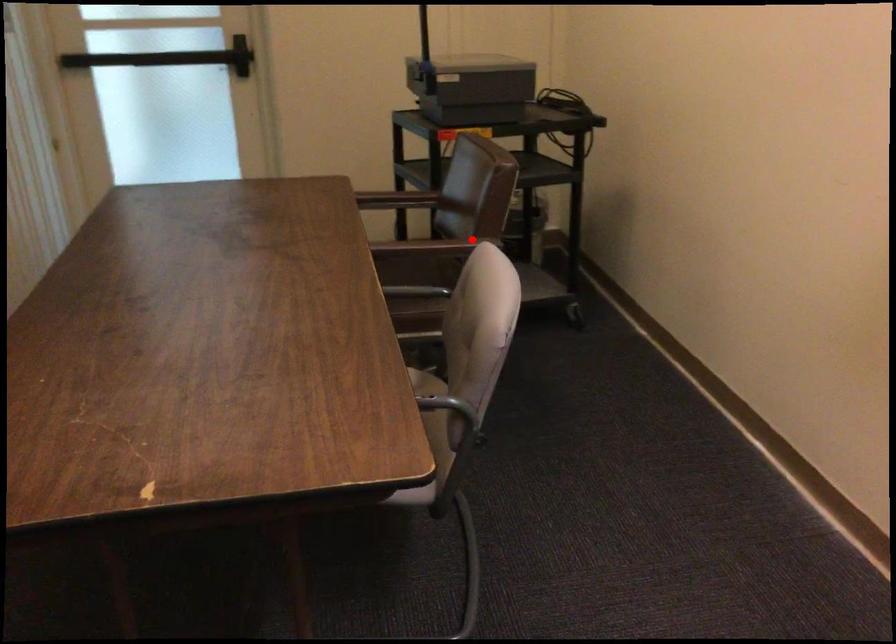
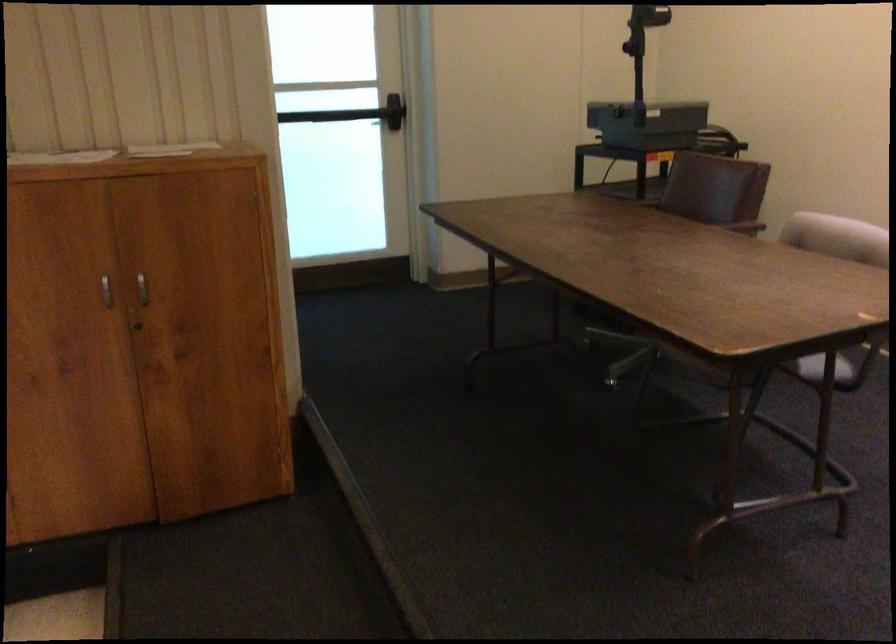
Question: I am providing you with two images of the same scene from different viewpoints. Image1 has a red point marked. In image2, the corresponding 3D location appears at what relative position? Reply with the corresponding letter.

Choices:
 (A) Closer
 (B) Farther

Answer: (B)